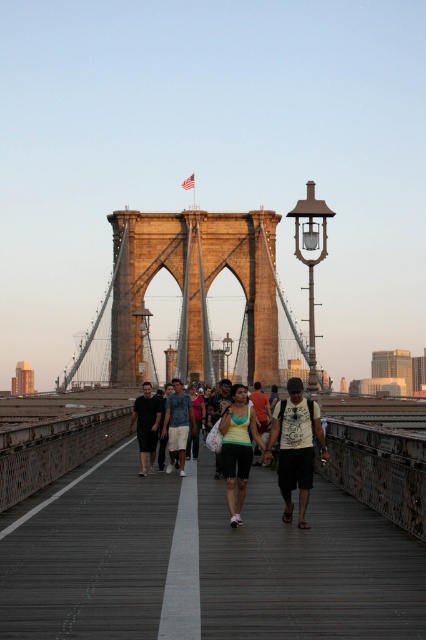
Describe the element at coordinates (192, 288) in the screenshot. I see `brown stone bridge at center` at that location.

Does point (189, 227) come farther from viewer compared to point (224, 419)?

That is True.

At what (x,y) coordinates should I click in order to perform the action: click on brown stone bridge at center. Please return your answer as a coordinate pair (x, y). Image resolution: width=426 pixels, height=640 pixels. Looking at the image, I should click on point(192,288).

Based on the photo, is light blue denim shorts at center to the left of black cotton shirt at center from the viewer's perspective?

Incorrect, light blue denim shorts at center is not on the left side of black cotton shirt at center.

Image resolution: width=426 pixels, height=640 pixels. Describe the element at coordinates (178, 424) in the screenshot. I see `light blue denim shorts at center` at that location.

Where is `light blue denim shorts at center`? light blue denim shorts at center is located at coordinates (178, 424).

Between wooden bridge at center and black cotton shirt at center, which one is positioned lower?

wooden bridge at center

Does wooden bridge at center lie in front of black cotton shirt at center?

Yes, wooden bridge at center is closer to the viewer.

Does point (233, 531) come in front of point (157, 410)?

Yes, it is in front of point (157, 410).

Locate an element on the screen. The height and width of the screenshot is (640, 426). wooden bridge at center is located at coordinates (201, 561).